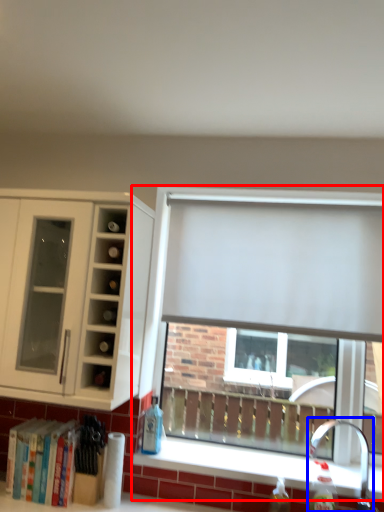
Question: Among these objects, which one is nearest to the camera, window (highlighted by a red box) or faucet (highlighted by a blue box)?

Choices:
 (A) window
 (B) faucet

Answer: (B)